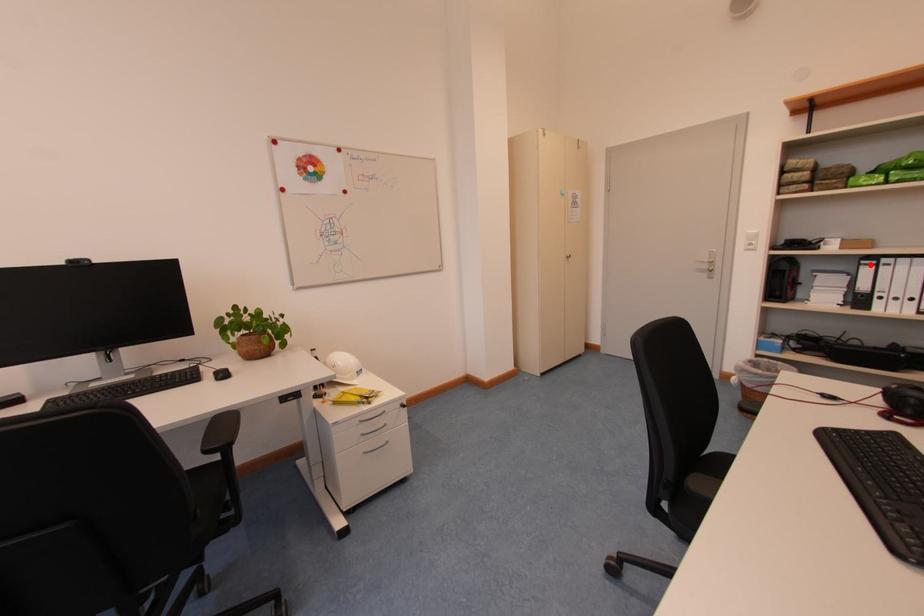
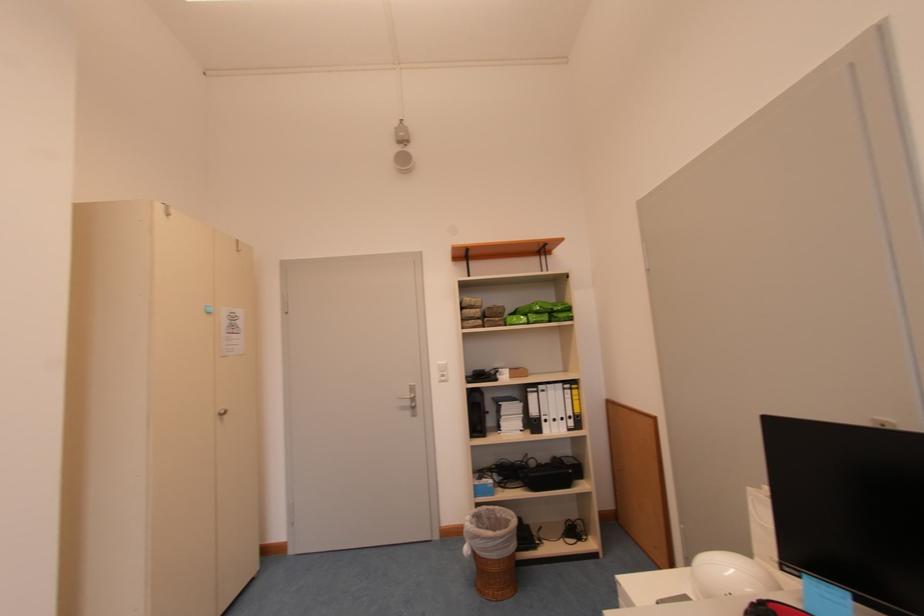
Find the pixel in the second image that matches the highlighted location in the first image.

(536, 392)